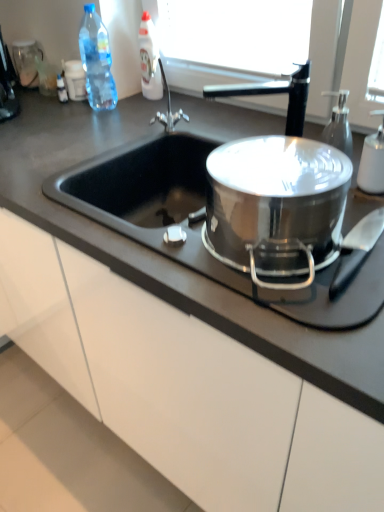
Question: In the image, is white glossy bottle at upper center, the second bottle viewed from the right, positioned in front of or behind white matte soap dispenser at right, which ranks as the 3th bottle in top-to-bottom order?

Choices:
 (A) front
 (B) behind

Answer: (B)

Question: In terms of height, does white glossy bottle at upper center, acting as the first bottle starting from the back, look taller or shorter compared to white matte soap dispenser at right, the 1th bottle in the bottom-to-top sequence?

Choices:
 (A) short
 (B) tall

Answer: (B)

Question: Considering the real-world distances, which object is farthest from the transparent glass soap dispenser at upper right?

Choices:
 (A) white matte soap dispenser at right, which ranks as the 3th bottle in top-to-bottom order
 (B) white glossy bottle at upper center, the second bottle from the left
 (C) black matte countertop at center
 (D) stainless steel pot at center
 (E) black plastic coffee machine at upper left

Answer: (E)

Question: Which object is the closest to the white matte soap dispenser at right, the first bottle positioned from the front?

Choices:
 (A) black plastic coffee machine at upper left
 (B) stainless steel pot at center
 (C) transparent glass soap dispenser at upper right
 (D) black matte countertop at center
 (E) white glossy bottle at upper center, the second bottle viewed from the right

Answer: (C)